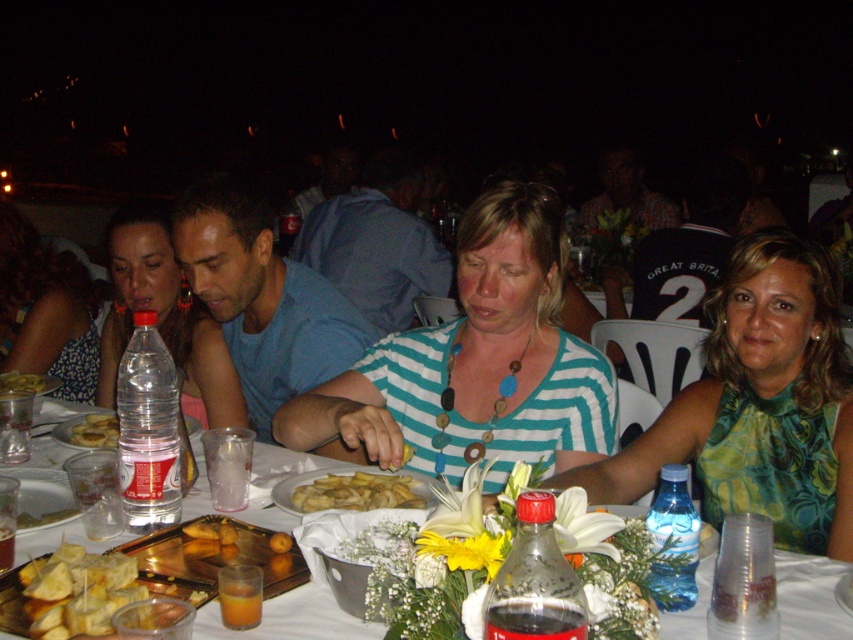
Is green printed dress at center further to camera compared to translucent plastic cup at lower left?

Yes.

Which is behind, point (712, 456) or point (9, 557)?

The point (712, 456) is more distant.

Where is `green printed dress at center`? green printed dress at center is located at coordinates (758, 404).

Where is `white floral dress at center`? white floral dress at center is located at coordinates pyautogui.click(x=45, y=310).

Does point (57, 342) lie in front of point (338, 493)?

No, it is not.

Between point (54, 262) and point (296, 504), which one is positioned in front?

Point (296, 504) is in front.

Where is `white floral dress at center`? The height and width of the screenshot is (640, 853). white floral dress at center is located at coordinates (45, 310).

Does green printed dress at center come behind translucent plastic cups at lower right?

Yes, green printed dress at center is behind translucent plastic cups at lower right.

Between green printed dress at center and translucent plastic cups at lower right, which one is positioned lower?

Positioned lower is translucent plastic cups at lower right.

What do you see at coordinates (758, 404) in the screenshot?
I see `green printed dress at center` at bounding box center [758, 404].

I want to click on green printed dress at center, so click(758, 404).